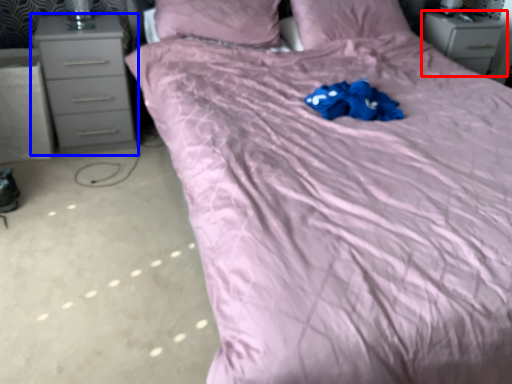
Question: Which of the following is the farthest to the observer, chest of drawers (highlighted by a red box) or chest of drawers (highlighted by a blue box)?

Choices:
 (A) chest of drawers
 (B) chest of drawers

Answer: (A)